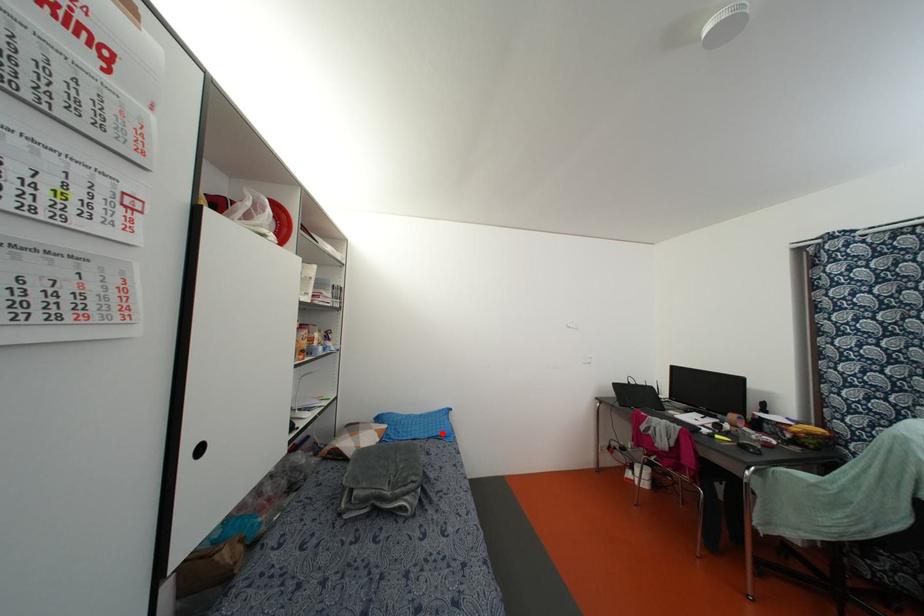
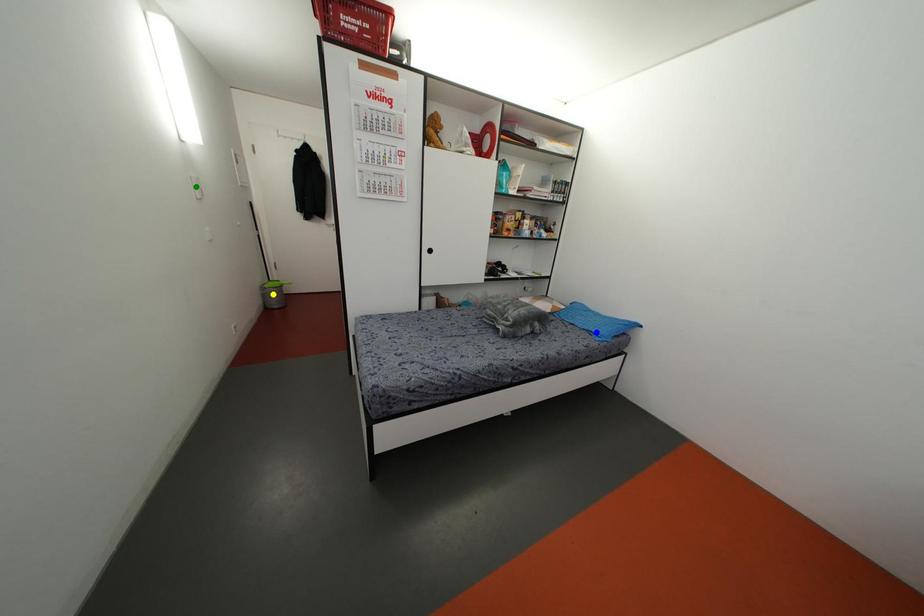
Question: I am providing you with two images of the same scene from different viewpoints. A red point is marked on the first image. You are given multiple points on the second image. Which point in image 2 is actually the same real-world point as the red point in image 1?

Choices:
 (A) green point
 (B) yellow point
 (C) blue point

Answer: (C)